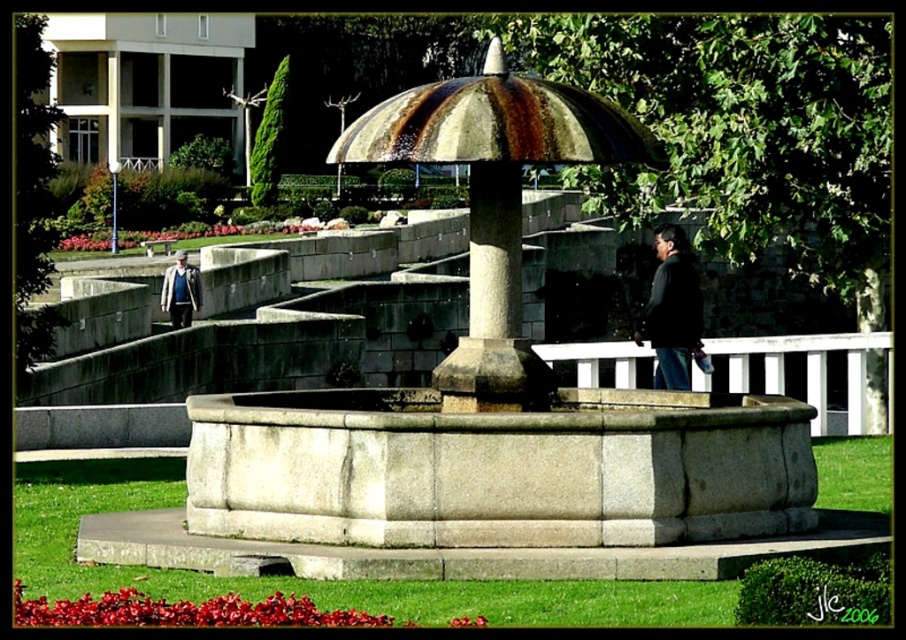
Which is in front, point (666, 285) or point (181, 324)?

Point (666, 285) is in front.

Consider the image. Who is positioned more to the left, dark gray jacket at center or dark blue jacket at center?

Positioned to the left is dark blue jacket at center.

Is point (670, 355) less distant than point (182, 262)?

Yes, point (670, 355) is in front of point (182, 262).

Find the location of a particular element. This screenshot has height=640, width=906. dark gray jacket at center is located at coordinates (672, 308).

Where is `rusty stone fountain at center`? rusty stone fountain at center is located at coordinates (495, 390).

Is rusty stone fountain at center positioned behind dark blue jacket at center?

No.

Who is more distant from viewer, (800, 481) or (178, 308)?

Positioned behind is point (178, 308).

The height and width of the screenshot is (640, 906). What are the coordinates of `rusty stone fountain at center` in the screenshot? It's located at (495, 390).

Looking at this image, does rusty stone fountain at center appear on the right side of dark gray jacket at center?

No, rusty stone fountain at center is not to the right of dark gray jacket at center.

Where is `rusty stone fountain at center`? rusty stone fountain at center is located at coordinates (495, 390).